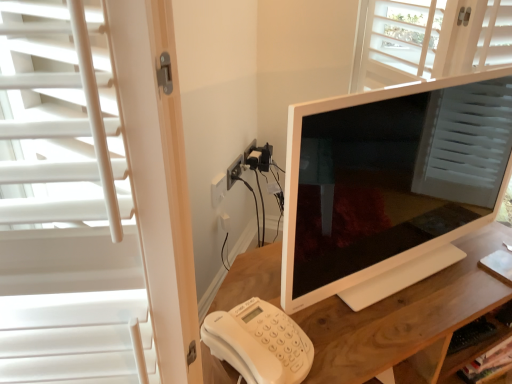
This screenshot has width=512, height=384. Identify the location of free space behind white plastic phone at lower left. (255, 285).